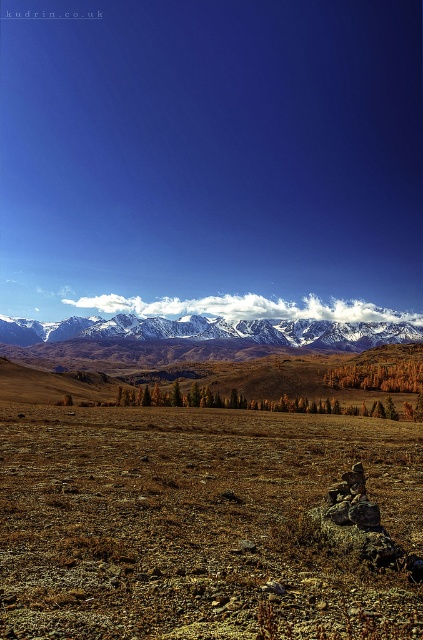
You are standing at the bottom of the mountain and looking at the landscape. There are two points marked in the image, one at point coordinate (13, 317) and the other at (384, 371). Which point is closer to you?

Point (13, 317) is closer to you because it is further to the camera than point (384, 371).